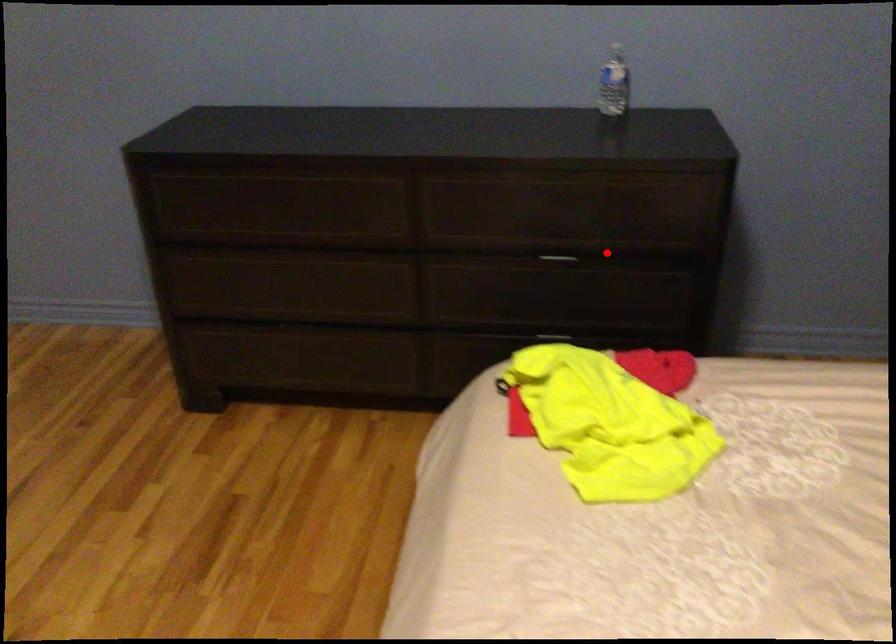
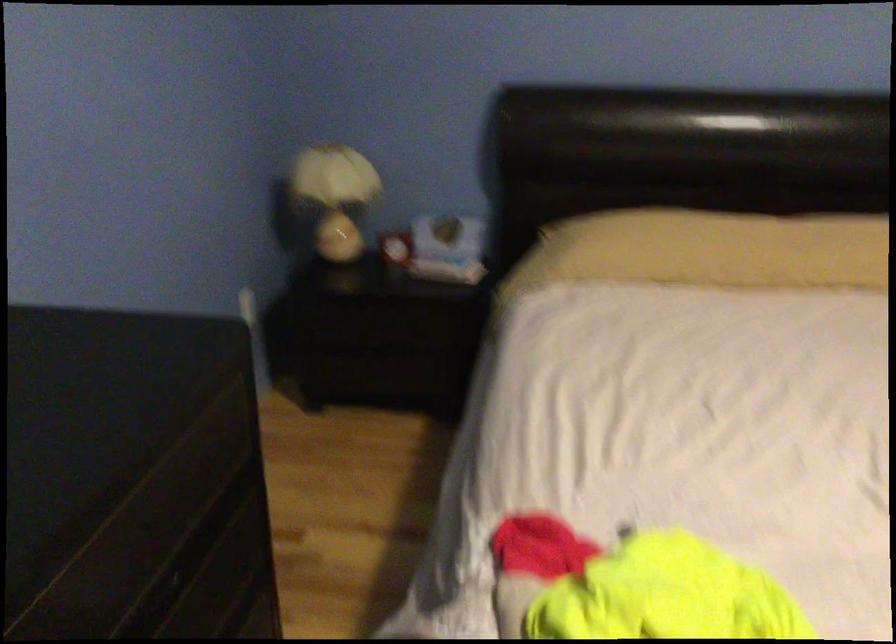
In the second image, find the point that corresponds to the highlighted location in the first image.

(186, 559)